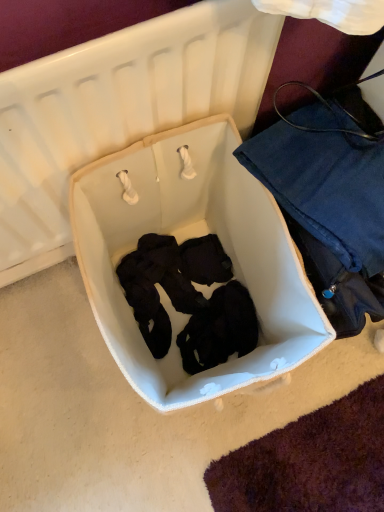
Question: Is denim fabric at right oriented away from white fabric infant bed at center?

Choices:
 (A) no
 (B) yes

Answer: (A)

Question: Could you tell me if denim fabric at right is facing white fabric infant bed at center?

Choices:
 (A) no
 (B) yes

Answer: (A)

Question: Does denim fabric at right contain white fabric infant bed at center?

Choices:
 (A) no
 (B) yes

Answer: (A)

Question: Is denim fabric at right taller than white fabric infant bed at center?

Choices:
 (A) no
 (B) yes

Answer: (B)

Question: Is denim fabric at right positioned beyond the bounds of white fabric infant bed at center?

Choices:
 (A) no
 (B) yes

Answer: (B)

Question: Is denim fabric at right thinner than white fabric infant bed at center?

Choices:
 (A) yes
 (B) no

Answer: (A)

Question: Is white fabric infant bed at center taller than denim fabric at right?

Choices:
 (A) yes
 (B) no

Answer: (B)

Question: From the image's perspective, is white fabric infant bed at center below denim fabric at right?

Choices:
 (A) yes
 (B) no

Answer: (A)

Question: Is white fabric infant bed at center positioned before denim fabric at right?

Choices:
 (A) yes
 (B) no

Answer: (A)

Question: Is white fabric infant bed at center smaller than denim fabric at right?

Choices:
 (A) yes
 (B) no

Answer: (B)

Question: Is denim fabric at right a part of white fabric infant bed at center?

Choices:
 (A) no
 (B) yes

Answer: (A)

Question: Can you confirm if white fabric infant bed at center is thinner than denim fabric at right?

Choices:
 (A) no
 (B) yes

Answer: (A)

Question: From a real-world perspective, is denim fabric at right physically located above or below white fabric infant bed at center?

Choices:
 (A) below
 (B) above

Answer: (B)